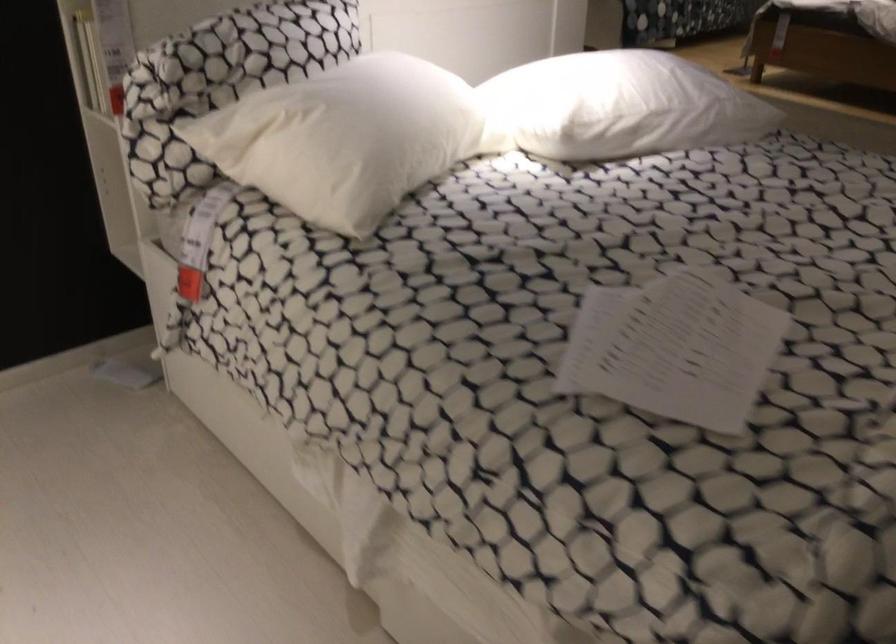
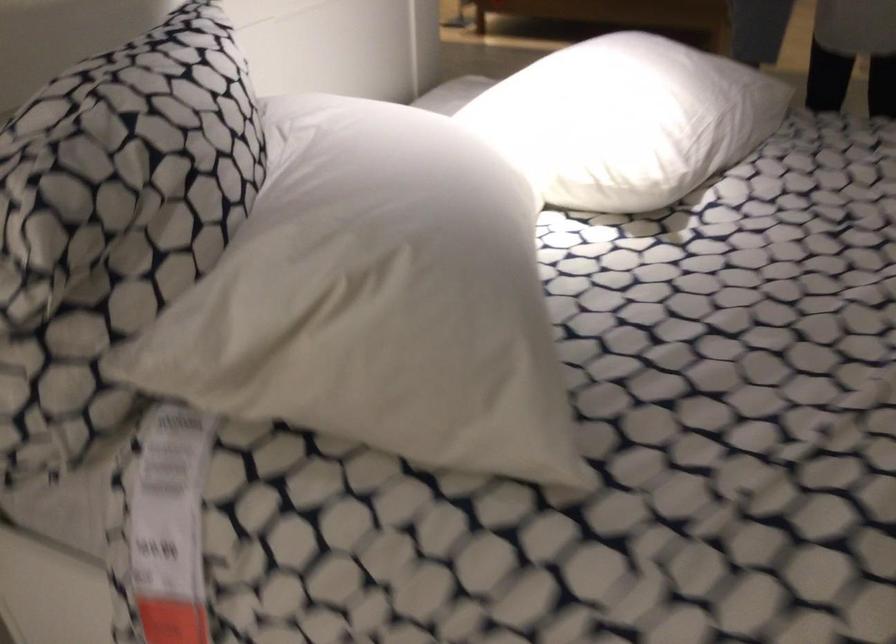
Question: The camera is either moving clockwise (left) or counter-clockwise (right) around the object. The first image is from the beginning of the video and the second image is from the end. Is the camera moving left or right when shooting the video?

Choices:
 (A) Left
 (B) Right

Answer: (A)